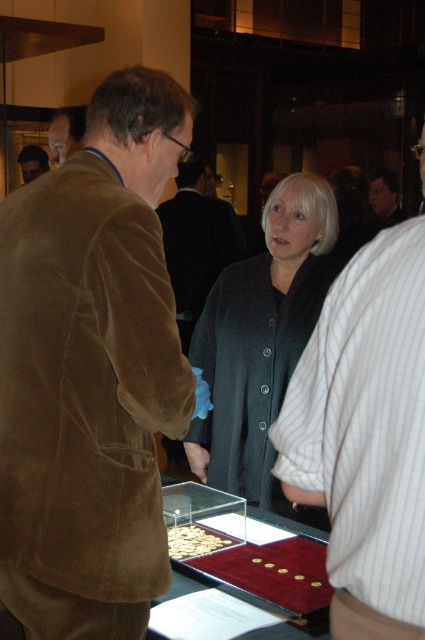
Question: Among these objects, which one is nearest to the camera?

Choices:
 (A) dark gray wool coat at center
 (B) shiny gold coins at center

Answer: (B)

Question: Can you confirm if suede jacket at left is positioned to the left of suede jacket at upper left?

Choices:
 (A) no
 (B) yes

Answer: (A)

Question: Which object appears closest to the camera in this image?

Choices:
 (A) gold plated coins at center
 (B) suede jacket at left
 (C) suede jacket at center
 (D) matte brown jacket at upper left

Answer: (B)

Question: From the image, what is the correct spatial relationship of suede jacket at left in relation to white striped shirt at right?

Choices:
 (A) below
 (B) above

Answer: (B)

Question: Among these objects, which one is nearest to the camera?

Choices:
 (A) suede jacket at left
 (B) gold plated coins at center
 (C) matte brown jacket at upper left

Answer: (A)

Question: Does suede jacket at center appear over suede jacket at upper left?

Choices:
 (A) no
 (B) yes

Answer: (A)